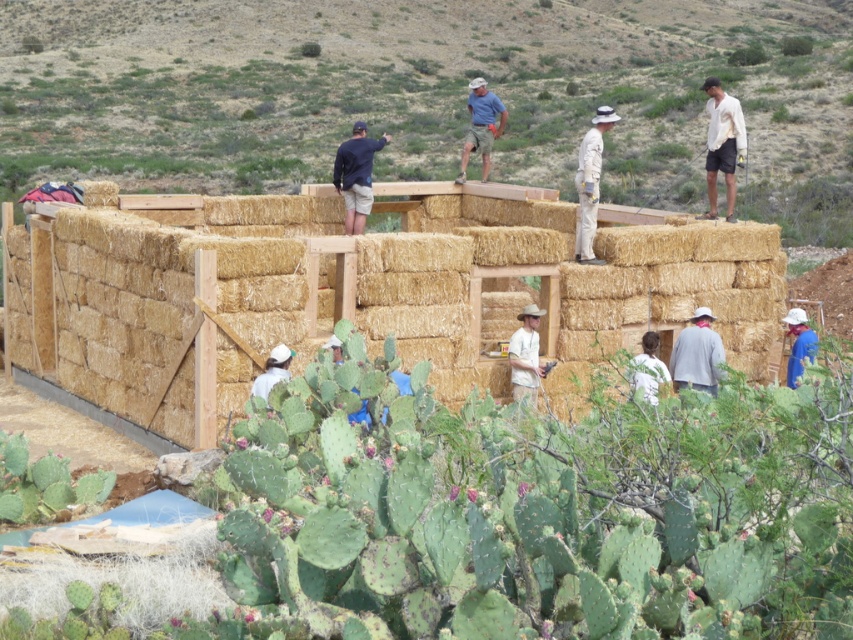
Question: Is natural straw wall at center positioned in front of white cotton shirt at upper right?

Choices:
 (A) no
 (B) yes

Answer: (B)

Question: Is straw bales at upper center positioned before dark blue shirt at upper center?

Choices:
 (A) no
 (B) yes

Answer: (A)

Question: Which point is closer to the camera?

Choices:
 (A) white matte hat at upper center
 (B) white cotton shirt at upper right

Answer: (A)

Question: In this image, where is straw bales at upper center located relative to white matte hat at upper center?

Choices:
 (A) above
 (B) below

Answer: (A)

Question: Which object is positioned closest to the blue fabric at lower right?

Choices:
 (A) matte blue shirt at upper center
 (B) white matte hat at upper center
 (C) natural straw wall at center

Answer: (B)

Question: Which point appears farthest from the camera in this image?

Choices:
 (A) (354, 211)
 (B) (219, 301)

Answer: (A)